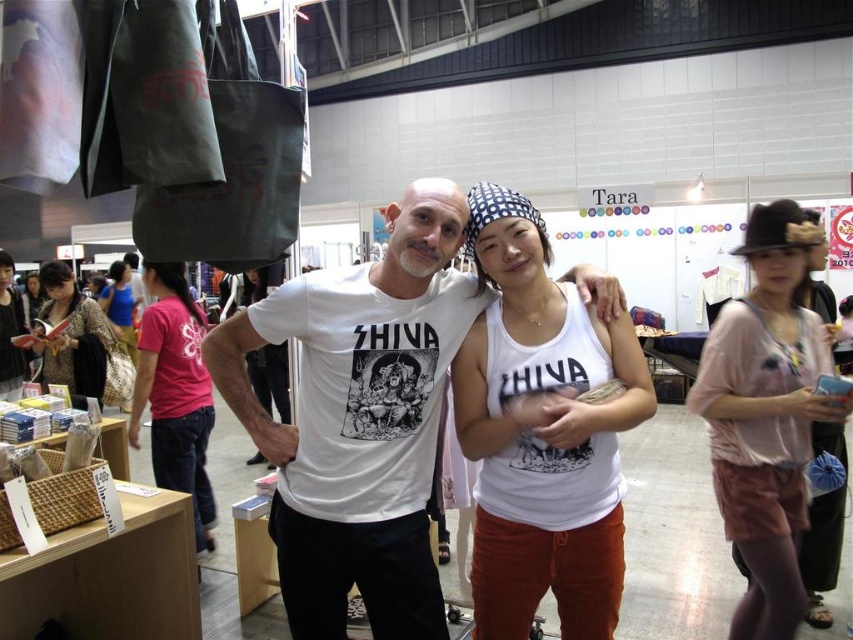
Question: Can you confirm if white cotton tank top at center is bigger than matte black shirt at left?

Choices:
 (A) no
 (B) yes

Answer: (A)

Question: Which of the following is the farthest from the observer?

Choices:
 (A) white cotton tank top at center
 (B) blue cotton tank top at center

Answer: (B)

Question: Among these objects, which one is farthest from the camera?

Choices:
 (A) blue cotton tank top at center
 (B) white cotton tank top at center

Answer: (A)

Question: Can you confirm if pink fabric shirt at left is positioned above matte black shirt at left?

Choices:
 (A) yes
 (B) no

Answer: (B)

Question: Can you confirm if matte black shirt at left is thinner than blue cotton tank top at center?

Choices:
 (A) yes
 (B) no

Answer: (A)

Question: Which object is closer to the camera taking this photo?

Choices:
 (A) white cotton t-shirt at center
 (B) blue cotton tank top at center

Answer: (A)